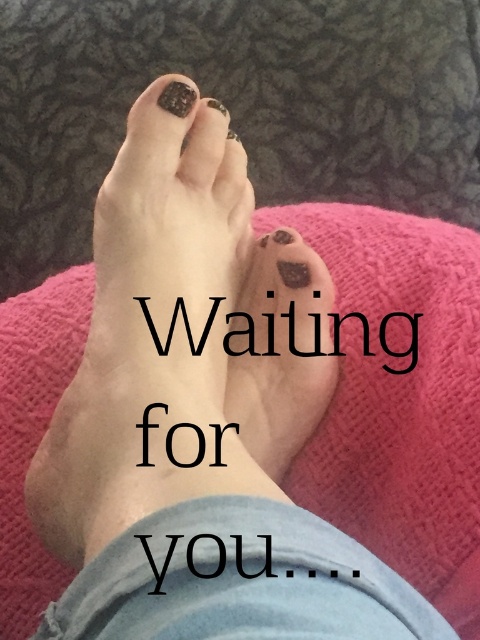
Is matte black toenail at center closer to camera compared to matte black nail at upper center?

That is True.

Can you confirm if matte black toenail at center is thinner than matte black nail at upper center?

No, matte black toenail at center is not thinner than matte black nail at upper center.

Who is more forward, (225, 152) or (168, 102)?

Point (168, 102) is in front.

Where is `matte black toenail at center`? This screenshot has height=640, width=480. matte black toenail at center is located at coordinates (151, 333).

In the scene shown: Between matte black nail at upper center and matte black nail at center, which one appears on the left side from the viewer's perspective?

From the viewer's perspective, matte black nail at upper center appears more on the left side.

Is matte black nail at upper center further to the viewer compared to matte black nail at center?

No, it is in front of matte black nail at center.

Which is behind, point (188, 96) or point (184, 150)?

Positioned behind is point (184, 150).

Where is `matte black nail at upper center`? matte black nail at upper center is located at coordinates (177, 99).

You are a GUI agent. You are given a task and a screenshot of the screen. Output one action in this format:
    pyautogui.click(x=<x>, y=<y>)
    Task: Click on the matte black toenail at center
    
    Given the screenshot: What is the action you would take?
    pyautogui.click(x=151, y=333)